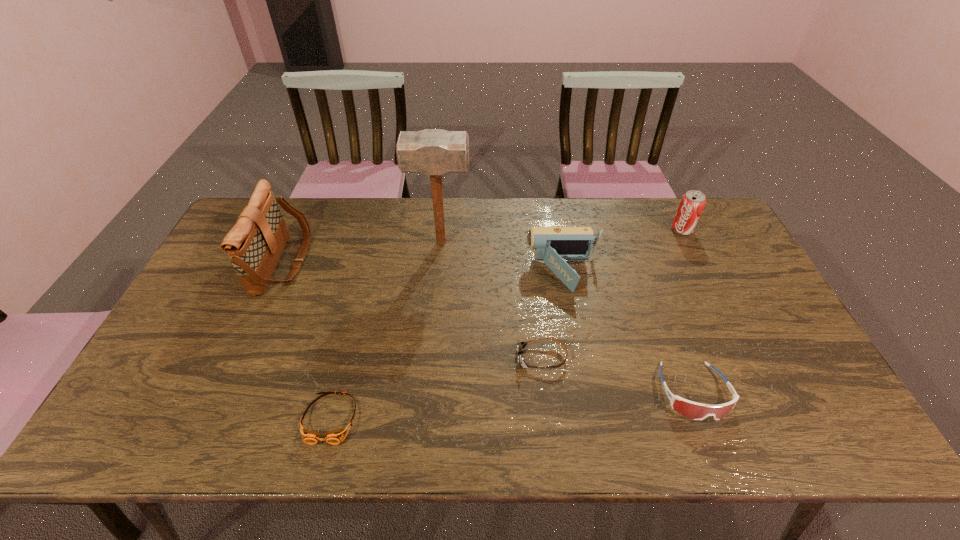
Locate an element on the screen. The image size is (960, 540). shoulder bag present at the far edge is located at coordinates (254, 245).

You are a GUI agent. You are given a task and a screenshot of the screen. Output one action in this format:
    pyautogui.click(x=<x>, y=<y>)
    Task: Click on the soda can located at the far edge
    
    Given the screenshot: What is the action you would take?
    pyautogui.click(x=692, y=203)

This screenshot has height=540, width=960. I want to click on object at the left edge, so click(x=254, y=245).

You are a GUI agent. You are given a task and a screenshot of the screen. Output one action in this format:
    pyautogui.click(x=<x>, y=<y>)
    Task: Click on the object situated at the right edge
    
    Given the screenshot: What is the action you would take?
    pyautogui.click(x=692, y=203)

Where is `object present at the far left corner`? The width and height of the screenshot is (960, 540). object present at the far left corner is located at coordinates (254, 245).

Locate an element on the screen. The image size is (960, 540). object present at the far right corner is located at coordinates (692, 203).

Find the location of a particular element. Image resolution: width=960 pixels, height=540 pixels. blank space at the far edge of the desktop is located at coordinates (479, 223).

At what (x,y) coordinates should I click in order to perform the action: click on vacant region at the near edge of the desktop. Please return your answer as a coordinate pair (x, y). Looking at the image, I should click on (214, 426).

Locate an element on the screen. The width and height of the screenshot is (960, 540). vacant space at the left edge of the desktop is located at coordinates (166, 364).

Image resolution: width=960 pixels, height=540 pixels. Find the location of `free space at the right edge of the desktop`. free space at the right edge of the desktop is located at coordinates (785, 340).